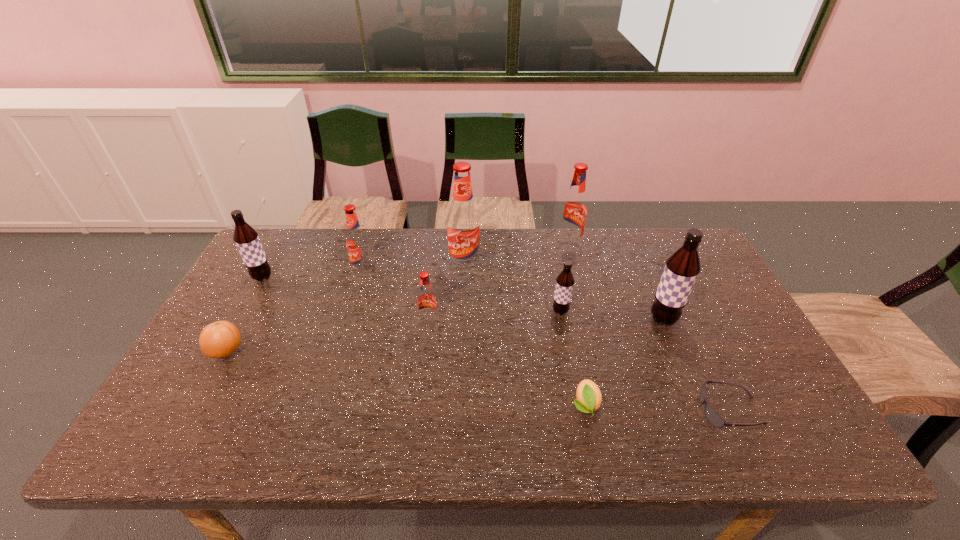
The height and width of the screenshot is (540, 960). I want to click on the tallest object, so click(x=463, y=221).

Find the location of `the tallest root beer`. the tallest root beer is located at coordinates (463, 221).

Identify the location of the sixth root beer from left to right. This screenshot has height=540, width=960. [574, 209].

Locate an element on the screen. The width and height of the screenshot is (960, 540). the farthest object is located at coordinates (574, 209).

Where is `the rightmost root beer`? The width and height of the screenshot is (960, 540). the rightmost root beer is located at coordinates (681, 270).

Where is `the rightmost brown root beer`? Image resolution: width=960 pixels, height=540 pixels. the rightmost brown root beer is located at coordinates (681, 270).

Identify the location of the leftmost red root beer. (356, 240).

Locate an element on the screen. the sixth root beer from right to left is located at coordinates (356, 240).

At what (x,y) coordinates should I click in order to perform the action: click on the leftmost root beer. Please return your answer as a coordinate pair (x, y). Image resolution: width=960 pixels, height=540 pixels. Looking at the image, I should click on (246, 238).

Image resolution: width=960 pixels, height=540 pixels. Find the location of `the leftmost brown root beer`. the leftmost brown root beer is located at coordinates (246, 238).